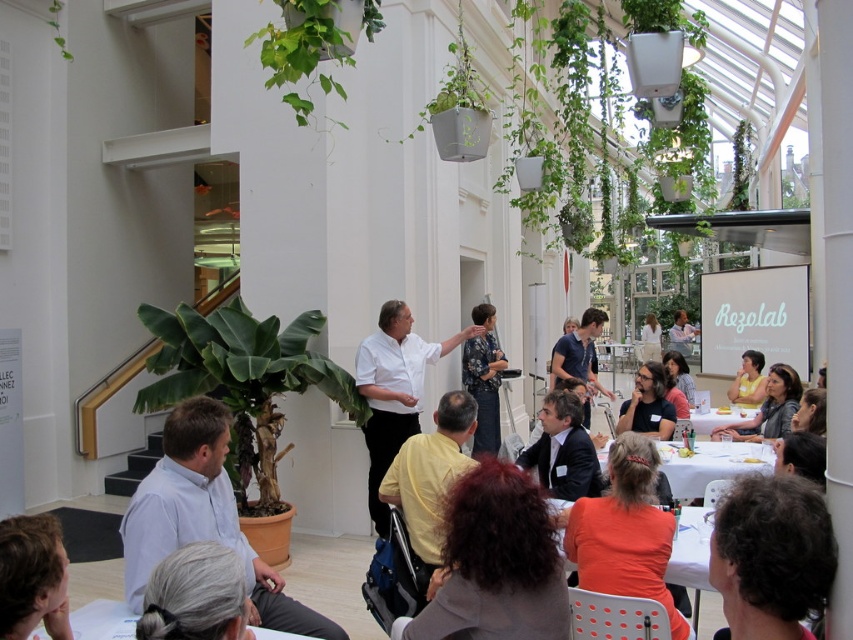
Does yellow matte shirt at center have a greater height compared to white plastic table at center?

Yes.

Can you confirm if yellow matte shirt at center is positioned to the right of white plastic table at center?

Incorrect, yellow matte shirt at center is not on the right side of white plastic table at center.

Which is in front, point (421, 465) or point (740, 461)?

Positioned in front is point (421, 465).

Find the location of a particular element. This screenshot has width=853, height=640. yellow matte shirt at center is located at coordinates (430, 474).

Is point (666, 403) positioned behind point (648, 323)?

No, (666, 403) is closer to viewer.

Is dark brown hair at center to the left of white fabric shirt at center from the viewer's perspective?

Correct, you'll find dark brown hair at center to the left of white fabric shirt at center.

Where is `dark brown hair at center`? This screenshot has height=640, width=853. dark brown hair at center is located at coordinates click(648, 404).

Identify the location of dark brown hair at center. The width and height of the screenshot is (853, 640). (648, 404).

Which of these two, dark brown curly hair at lower right or orange matte shirt at lower center, stands taller?

orange matte shirt at lower center is taller.

Is dark brown curly hair at lower right shorter than orange matte shirt at lower center?

Correct, dark brown curly hair at lower right is not as tall as orange matte shirt at lower center.

Between point (834, 560) and point (625, 488), which one is positioned in front?

Positioned in front is point (834, 560).

This screenshot has width=853, height=640. I want to click on dark brown curly hair at lower right, so click(x=770, y=556).